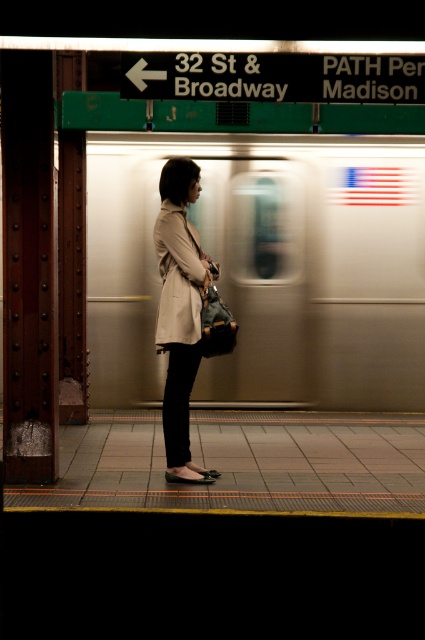
What is the exact coordinate of the silver metallic train at center?

The silver metallic train at center is located at point (266, 268).